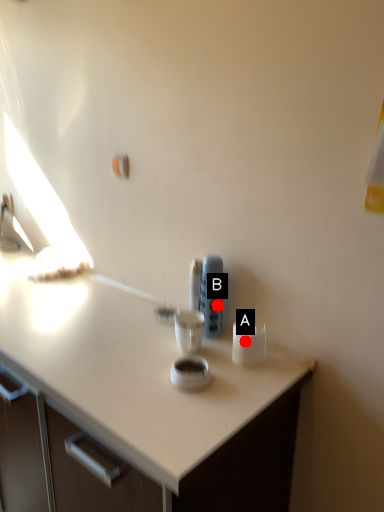
Question: Two points are circled on the image, labeled by A and B beside each circle. Which point appears closest to the camera in this image?

Choices:
 (A) A is closer
 (B) B is closer

Answer: (A)